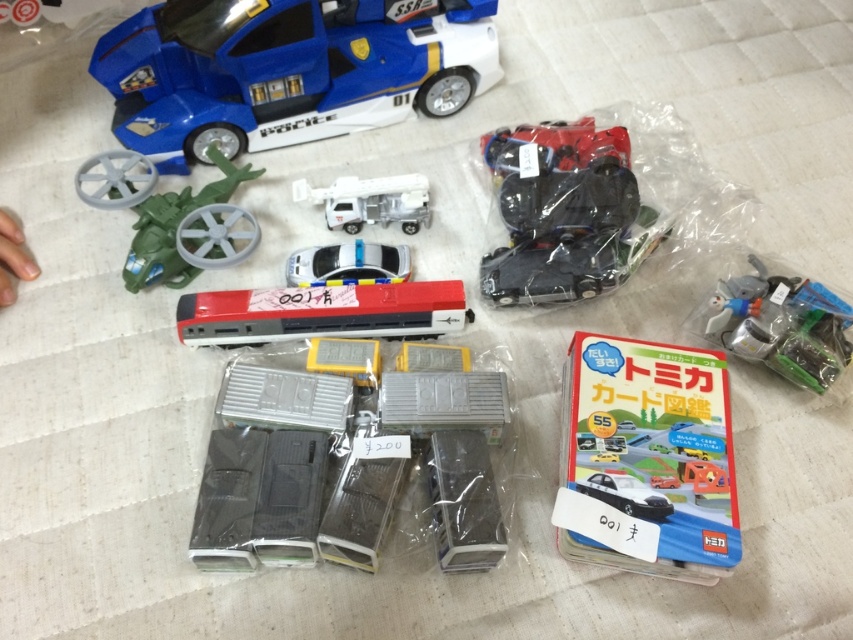
You are organizing a toy display and want to place the blue plastic toy car at upper left and the green matte helicopter at upper left on a shelf. If the shelf has limited width, which toy should you place first to ensure both fit?

The blue plastic toy car at upper left is wider than the green matte helicopter at upper left. To ensure both fit on the shelf, place the wider blue plastic toy car at upper left first, then the narrower green matte helicopter at upper left next.

You are a child trying to reach the matte plastic book at center from the blue plastic toy car at upper left. Which direction should you move in to get closer to the book?

The blue plastic toy car at upper left is closer to you than the matte plastic book at center, so you should move downward towards the center to get closer to the matte plastic book at center.

You are a child playing with the toys on the table. You want to place a new toy truck exactly where the blue plastic toy car at upper left is currently located. Is there enough space to do this without moving any other toys?

The blue plastic toy car at upper left is located at point (287, 70). Since the question doesn not provide information about the size of the new toy truck or the spacing between the blue plastic toy car at upper left and other toys, it is impossible to determine if there is enough space to place the new toy truck without moving other toys.